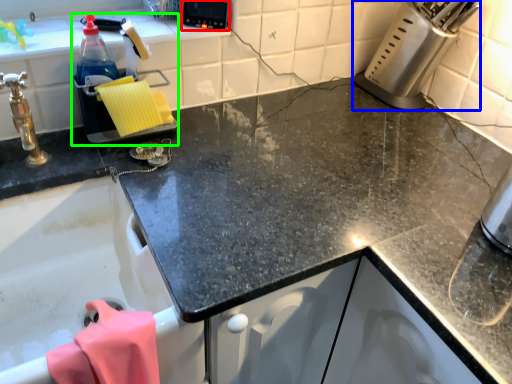
Question: Considering the real-world distances, which object is farthest from appliance (highlighted by a red box)? appliance (highlighted by a blue box) or appliance (highlighted by a green box)?

Choices:
 (A) appliance
 (B) appliance

Answer: (A)